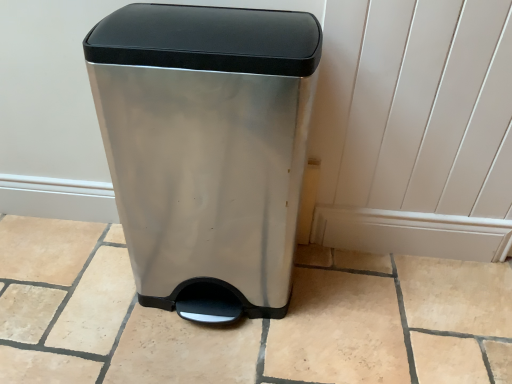
At what (x,y) coordinates should I click in order to perform the action: click on free point in front of satin silver trash can at center. Please return your answer as a coordinate pair (x, y). This screenshot has width=512, height=384. Looking at the image, I should click on (211, 357).